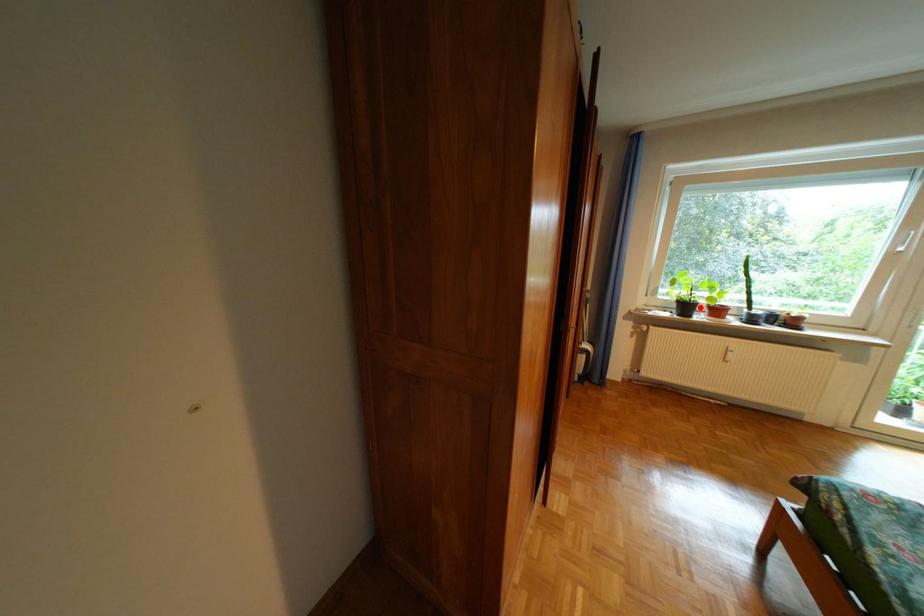
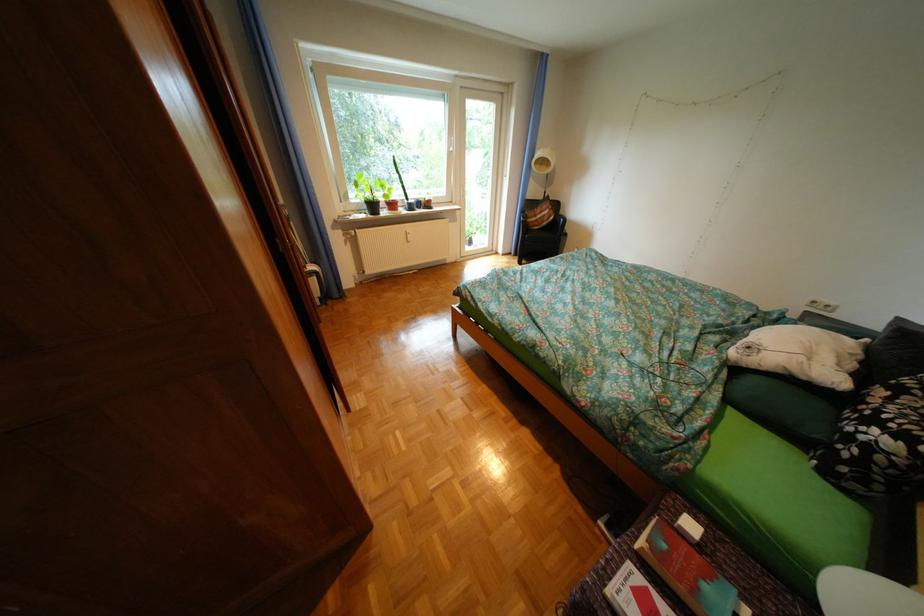
The point at the highlighted location is marked in the first image. Where is the corresponding point in the second image?

(387, 207)